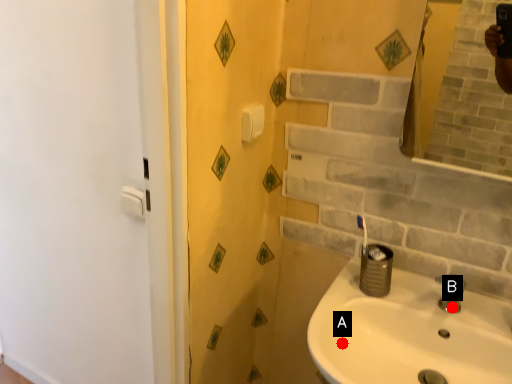
Question: Two points are circled on the image, labeled by A and B beside each circle. Which point is closer to the camera?

Choices:
 (A) A is closer
 (B) B is closer

Answer: (B)